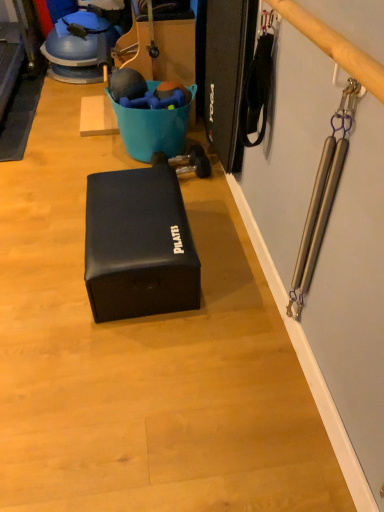
Question: From the image's perspective, is dark blue rubber yoga mat at left under black leather box at center?

Choices:
 (A) yes
 (B) no

Answer: (B)

Question: From a real-world perspective, is dark blue rubber yoga mat at left positioned over black leather box at center based on gravity?

Choices:
 (A) yes
 (B) no

Answer: (B)

Question: Does dark blue rubber yoga mat at left have a lesser height compared to black leather box at center?

Choices:
 (A) no
 (B) yes

Answer: (B)

Question: Is dark blue rubber yoga mat at left not within black leather box at center?

Choices:
 (A) no
 (B) yes

Answer: (B)

Question: From a real-world perspective, is dark blue rubber yoga mat at left physically below black leather box at center?

Choices:
 (A) yes
 (B) no

Answer: (A)

Question: Does dark blue rubber yoga mat at left have a greater height compared to black leather box at center?

Choices:
 (A) no
 (B) yes

Answer: (A)

Question: Is dark blue rubber yoga mat at left completely or partially inside black leather box at center?

Choices:
 (A) yes
 (B) no

Answer: (B)

Question: From the image's perspective, would you say black leather box at center is shown under dark blue rubber yoga mat at left?

Choices:
 (A) no
 (B) yes

Answer: (B)

Question: Is black leather box at center bigger than dark blue rubber yoga mat at left?

Choices:
 (A) yes
 (B) no

Answer: (A)

Question: From a real-world perspective, is black leather box at center below dark blue rubber yoga mat at left?

Choices:
 (A) yes
 (B) no

Answer: (B)

Question: Does black leather box at center have a greater width compared to dark blue rubber yoga mat at left?

Choices:
 (A) yes
 (B) no

Answer: (B)

Question: Considering the relative sizes of black leather box at center and dark blue rubber yoga mat at left in the image provided, is black leather box at center shorter than dark blue rubber yoga mat at left?

Choices:
 (A) yes
 (B) no

Answer: (B)

Question: Looking at their shapes, would you say dark blue rubber yoga mat at left is wider or thinner than black leather box at center?

Choices:
 (A) wide
 (B) thin

Answer: (A)